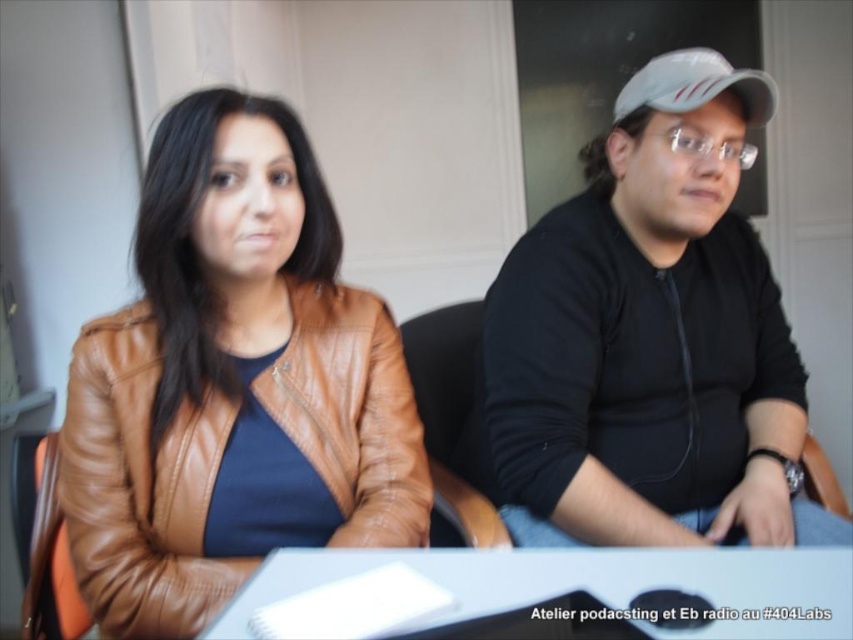
Question: Can you confirm if black matte shirt at right is positioned to the right of brown leather jacket at left?

Choices:
 (A) no
 (B) yes

Answer: (B)

Question: Among these objects, which one is nearest to the camera?

Choices:
 (A) brown leather jacket at left
 (B) black matte shirt at right
 (C) white glossy table at center
 (D) white matte baseball cap at upper right

Answer: (C)

Question: Does black matte shirt at right have a greater width compared to brown leather jacket at left?

Choices:
 (A) yes
 (B) no

Answer: (A)

Question: Which of these objects is positioned closest to the brown leather jacket at left?

Choices:
 (A) black matte shirt at right
 (B) white glossy table at center
 (C) white matte baseball cap at upper right

Answer: (B)

Question: Which is farther from the white matte baseball cap at upper right?

Choices:
 (A) brown leather jacket at left
 (B) black matte shirt at right
 (C) white glossy table at center

Answer: (A)

Question: Is brown leather jacket at left further to the viewer compared to white glossy table at center?

Choices:
 (A) yes
 (B) no

Answer: (A)